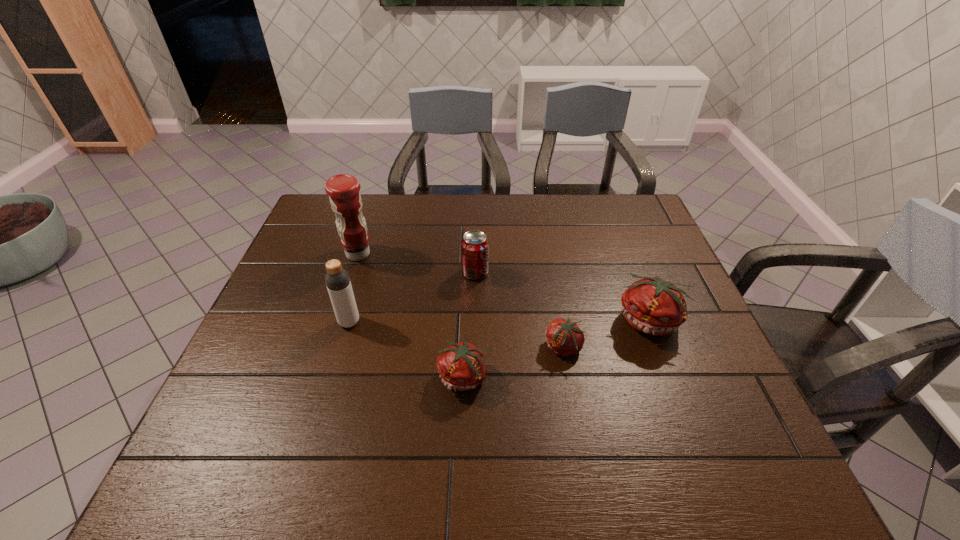
The width and height of the screenshot is (960, 540). Find the location of `vacant place for an extra tomato on the left`. vacant place for an extra tomato on the left is located at coordinates (353, 410).